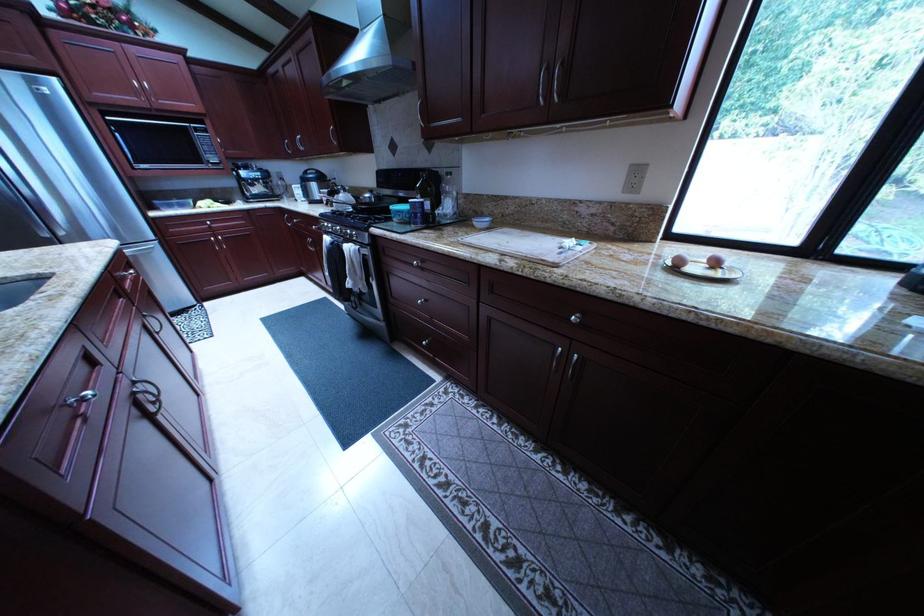
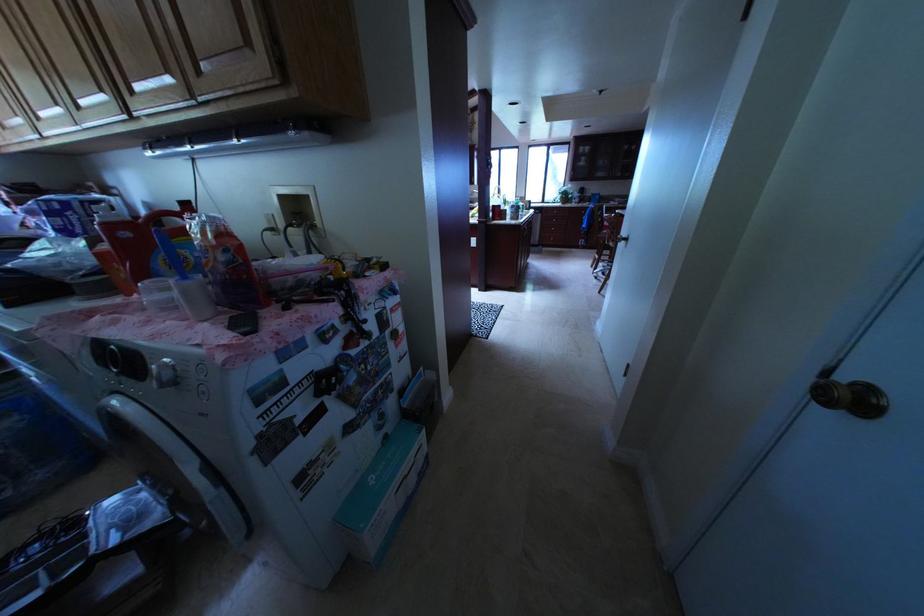
Question: I am providing you with two images of the same scene from different viewpoints. After the viewpoint changes to image2, which objects are now occluded?

Choices:
 (A) white whiteboard marker
 (B) silver control dial
 (C) orange detergent bottle
 (D) refrigerator handle

Answer: (D)